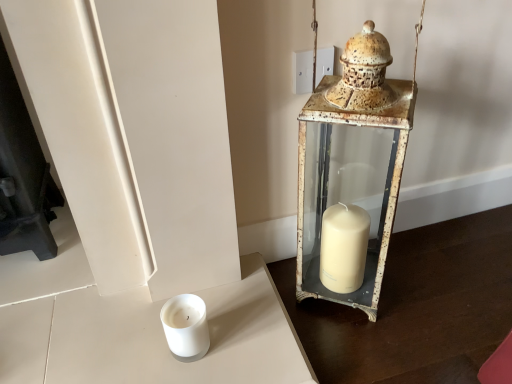
Image resolution: width=512 pixels, height=384 pixels. What do you see at coordinates (352, 167) in the screenshot?
I see `rusty metal lantern at right` at bounding box center [352, 167].

The width and height of the screenshot is (512, 384). What are the coordinates of `rusty metal lantern at right` in the screenshot? It's located at (352, 167).

Measure the distance between point (195, 347) and camera.

They are 31.26 inches apart.

This screenshot has height=384, width=512. Describe the element at coordinates (186, 327) in the screenshot. I see `white matte candle at lower left` at that location.

Locate an element on the screen. Image resolution: width=512 pixels, height=384 pixels. white matte candle at lower left is located at coordinates (186, 327).

Image resolution: width=512 pixels, height=384 pixels. Identify the location of rusty metal lantern at right. (352, 167).

Between white matte candle at lower left and rusty metal lantern at right, which one appears on the right side from the viewer's perspective?

rusty metal lantern at right.

Is the depth of white matte candle at lower left less than that of rusty metal lantern at right?

No, it is not.

Considering the points (167, 304) and (315, 232), which point is behind, point (167, 304) or point (315, 232)?

The point (315, 232) is farther.

From the image's perspective, which one is positioned lower, white matte candle at lower left or rusty metal lantern at right?

white matte candle at lower left appears lower in the image.

In the scene shown: From a real-world perspective, which is physically below, white matte candle at lower left or rusty metal lantern at right?

In real-world perspective, white matte candle at lower left is lower.

Between white matte candle at lower left and rusty metal lantern at right, which one has larger width?

Wider between the two is rusty metal lantern at right.

Between white matte candle at lower left and rusty metal lantern at right, which one has less height?

Standing shorter between the two is white matte candle at lower left.

Looking at the image, does white matte candle at lower left seem bigger or smaller compared to rusty metal lantern at right?

In the image, white matte candle at lower left appears to be smaller than rusty metal lantern at right.

Can rusty metal lantern at right be found inside white matte candle at lower left?

No, rusty metal lantern at right is located outside of white matte candle at lower left.

Is white matte candle at lower left far away from rusty metal lantern at right?

They are positioned close to each other.

Is white matte candle at lower left facing towards rusty metal lantern at right?

No, white matte candle at lower left is not turned towards rusty metal lantern at right.

How far apart are white matte candle at lower left and rusty metal lantern at right?

15.82 inches.

Locate an element on the screen. Image resolution: width=512 pixels, height=384 pixels. candle holder below the rusty metal lantern at right (from the image's perspective) is located at coordinates (186, 327).

Is rusty metal lantern at right at the right side of white matte candle at lower left?

Yes, rusty metal lantern at right is to the right of white matte candle at lower left.

Is the position of rusty metal lantern at right less distant than that of white matte candle at lower left?

Yes, it is in front of white matte candle at lower left.

Does point (325, 170) come closer to viewer compared to point (204, 320)?

That is False.

From the image's perspective, is rusty metal lantern at right above or below white matte candle at lower left?

Clearly, from the image's perspective, rusty metal lantern at right is above white matte candle at lower left.

From a real-world perspective, who is located higher, rusty metal lantern at right or white matte candle at lower left?

rusty metal lantern at right is physically above.

Is rusty metal lantern at right wider or thinner than white matte candle at lower left?

rusty metal lantern at right is wider than white matte candle at lower left.

Is rusty metal lantern at right taller than white matte candle at lower left?

Indeed, rusty metal lantern at right has a greater height compared to white matte candle at lower left.

Considering the relative sizes of rusty metal lantern at right and white matte candle at lower left in the image provided, is rusty metal lantern at right bigger than white matte candle at lower left?

Yes.

Which is correct: rusty metal lantern at right is inside white matte candle at lower left, or outside of it?

rusty metal lantern at right is outside white matte candle at lower left.

Would you consider rusty metal lantern at right to be distant from white matte candle at lower left?

No.

Is rusty metal lantern at right facing away from white matte candle at lower left?

No, white matte candle at lower left is not at the back of rusty metal lantern at right.

What's the angular difference between rusty metal lantern at right and white matte candle at lower left's facing directions?

They differ by 32.9 degrees in their facing directions.

Identify the location of lantern above the white matte candle at lower left (from the image's perspective). (352, 167).

At what (x,y) coordinates should I click in order to perform the action: click on lantern that appears on the right of white matte candle at lower left. Please return your answer as a coordinate pair (x, y). The width and height of the screenshot is (512, 384). Looking at the image, I should click on (352, 167).

Where is `lantern that is above the white matte candle at lower left (from the image's perspective)`? This screenshot has height=384, width=512. lantern that is above the white matte candle at lower left (from the image's perspective) is located at coordinates (352, 167).